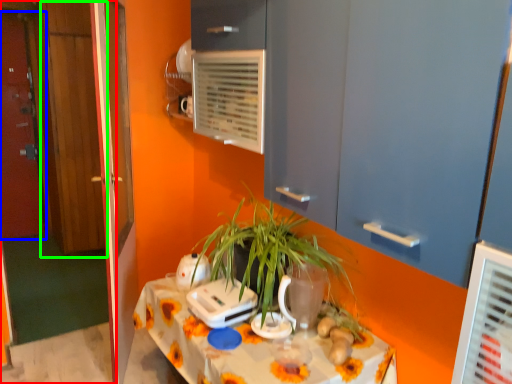
Question: Which object is positioned closest to door (highlighted by a red box)? Select from door (highlighted by a blue box) and door (highlighted by a green box).

Choices:
 (A) door
 (B) door

Answer: (B)